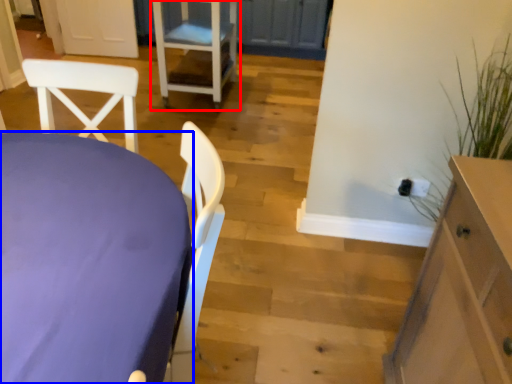
Question: Which point is closer to the camera, chair (highlighted by a red box) or table (highlighted by a blue box)?

Choices:
 (A) chair
 (B) table

Answer: (B)